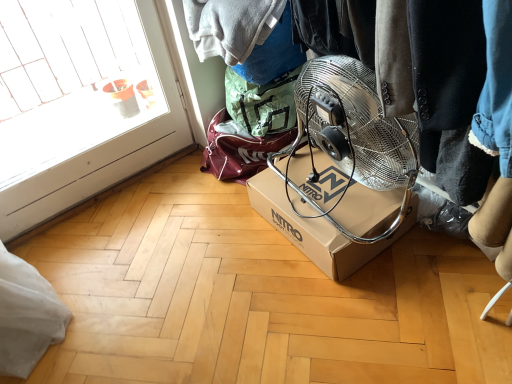
Image resolution: width=512 pixels, height=384 pixels. Describe the element at coordinates (93, 121) in the screenshot. I see `transparent glass door at left` at that location.

The height and width of the screenshot is (384, 512). I want to click on transparent glass door at left, so click(93, 121).

Measure the distance between brown cardboard box at center and camera.

brown cardboard box at center is 1.36 meters from camera.

Where is `brown cardboard box at center`? This screenshot has height=384, width=512. brown cardboard box at center is located at coordinates (317, 229).

Describe the element at coordinates (317, 229) in the screenshot. I see `brown cardboard box at center` at that location.

Locate an element on the screen. The height and width of the screenshot is (384, 512). transparent glass door at left is located at coordinates (93, 121).

Considering the positions of objects transparent glass door at left and brown cardboard box at center in the image provided, who is more to the left, transparent glass door at left or brown cardboard box at center?

Positioned to the left is transparent glass door at left.

Does transparent glass door at left lie behind brown cardboard box at center?

No, transparent glass door at left is closer to the viewer.

Which is closer, (175, 95) or (264, 205)?

The point (264, 205) is more forward.

From the image's perspective, is transparent glass door at left over brown cardboard box at center?

Yes, from the image's perspective, transparent glass door at left is on top of brown cardboard box at center.

From a real-world perspective, who is located higher, transparent glass door at left or brown cardboard box at center?

transparent glass door at left, from a real-world perspective.

Does transparent glass door at left have a lesser width compared to brown cardboard box at center?

Yes.

From their relative heights in the image, would you say transparent glass door at left is taller or shorter than brown cardboard box at center?

In the image, transparent glass door at left appears to be taller than brown cardboard box at center.

Does transparent glass door at left have a larger size compared to brown cardboard box at center?

Indeed, transparent glass door at left has a larger size compared to brown cardboard box at center.

Would you say transparent glass door at left is outside brown cardboard box at center?

Yes, transparent glass door at left is located beyond the bounds of brown cardboard box at center.

Is there a large distance between transparent glass door at left and brown cardboard box at center?

Indeed, transparent glass door at left is not near brown cardboard box at center.

Is transparent glass door at left aimed at brown cardboard box at center?

Yes, transparent glass door at left is oriented towards brown cardboard box at center.

Can you tell me how much transparent glass door at left and brown cardboard box at center differ in facing direction?

They differ by 91.6 degrees in their facing directions.

Measure the distance from transparent glass door at left to brown cardboard box at center.

transparent glass door at left and brown cardboard box at center are 1.24 meters apart from each other.

Find the location of `glass door above the brown cardboard box at center (from the image's perspective)`. glass door above the brown cardboard box at center (from the image's perspective) is located at coordinates (93, 121).

Between brown cardboard box at center and transparent glass door at left, which one appears on the right side from the viewer's perspective?

brown cardboard box at center is more to the right.

Which object is more forward, brown cardboard box at center or transparent glass door at left?

transparent glass door at left is more forward.

Considering the points (328, 196) and (106, 52), which point is behind, point (328, 196) or point (106, 52)?

The point (106, 52) is more distant.

From the image's perspective, would you say brown cardboard box at center is positioned over transparent glass door at left?

Incorrect, from the image's perspective, brown cardboard box at center is lower than transparent glass door at left.

From a real-world perspective, which object rests below the other?

brown cardboard box at center is physically lower.

Is brown cardboard box at center thinner than transparent glass door at left?

No.

Does brown cardboard box at center have a greater height compared to transparent glass door at left?

No, brown cardboard box at center is not taller than transparent glass door at left.

Who is smaller, brown cardboard box at center or transparent glass door at left?

Smaller between the two is brown cardboard box at center.

Choose the correct answer: Is brown cardboard box at center inside transparent glass door at left or outside it?

brown cardboard box at center exists outside the volume of transparent glass door at left.

Is brown cardboard box at center with transparent glass door at left?

brown cardboard box at center is not next to transparent glass door at left, and they're not touching.

Does brown cardboard box at center turn towards transparent glass door at left?

No.

Can you tell me how much brown cardboard box at center and transparent glass door at left differ in facing direction?

brown cardboard box at center and transparent glass door at left are facing 91.6 degrees away from each other.

What are the coordinates of `glass door on the left side of brown cardboard box at center` in the screenshot? It's located at (93, 121).

The width and height of the screenshot is (512, 384). I want to click on glass door in front of the brown cardboard box at center, so click(x=93, y=121).

In order to click on box below the transparent glass door at left (from the image's perspective) in this screenshot , I will do `click(317, 229)`.